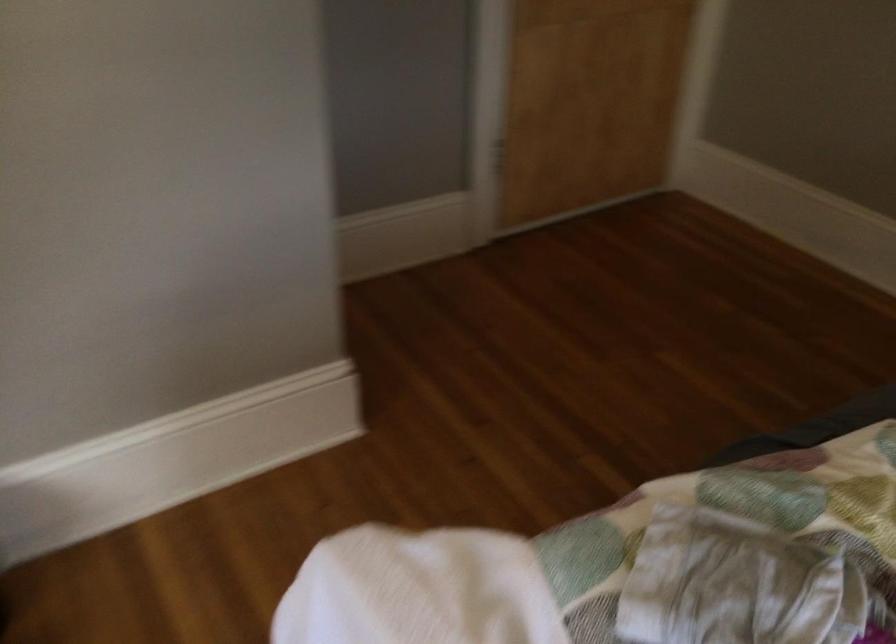
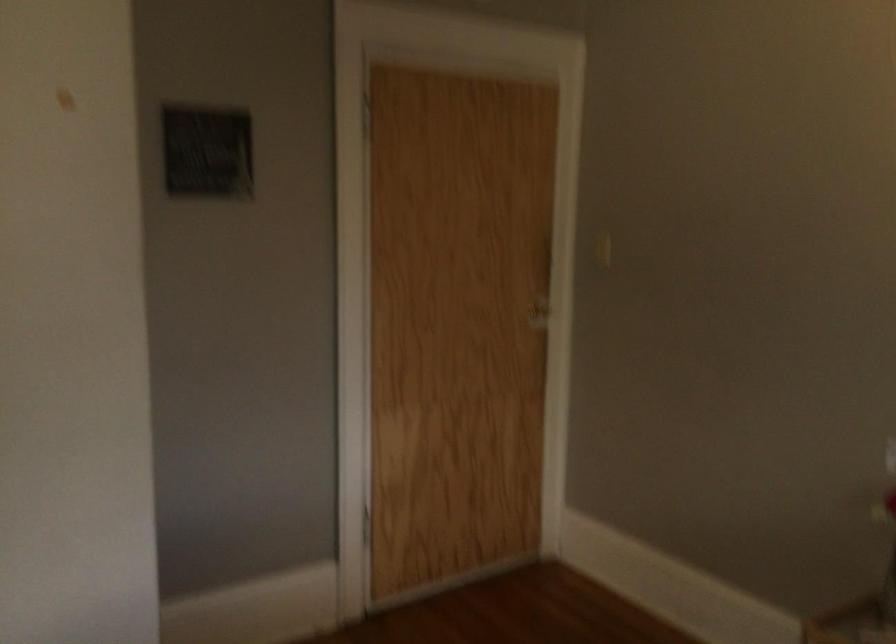
Question: Based on the continuous images, in which direction is the camera rotating? Reply with the corresponding letter.

Choices:
 (A) Left
 (B) Right
 (C) Up
 (D) Down

Answer: (C)